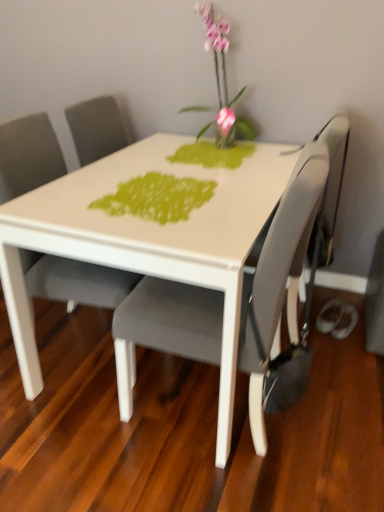
Locate an element on the screen. The image size is (384, 512). free space in front of green textured placemat at center is located at coordinates (168, 231).